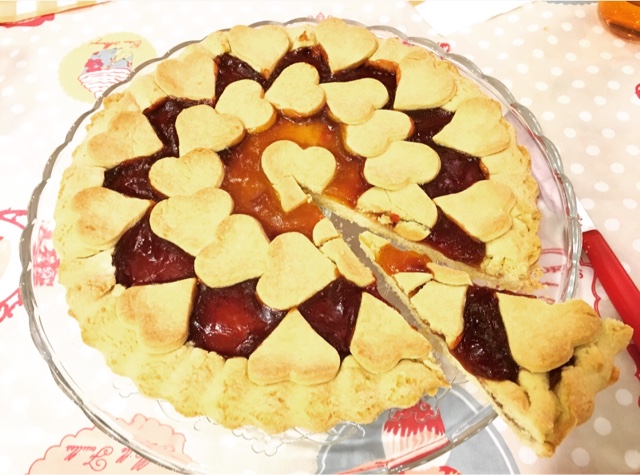
Locate an element on the screen. The width and height of the screenshot is (640, 475). 1 glass dish is located at coordinates (560, 227).